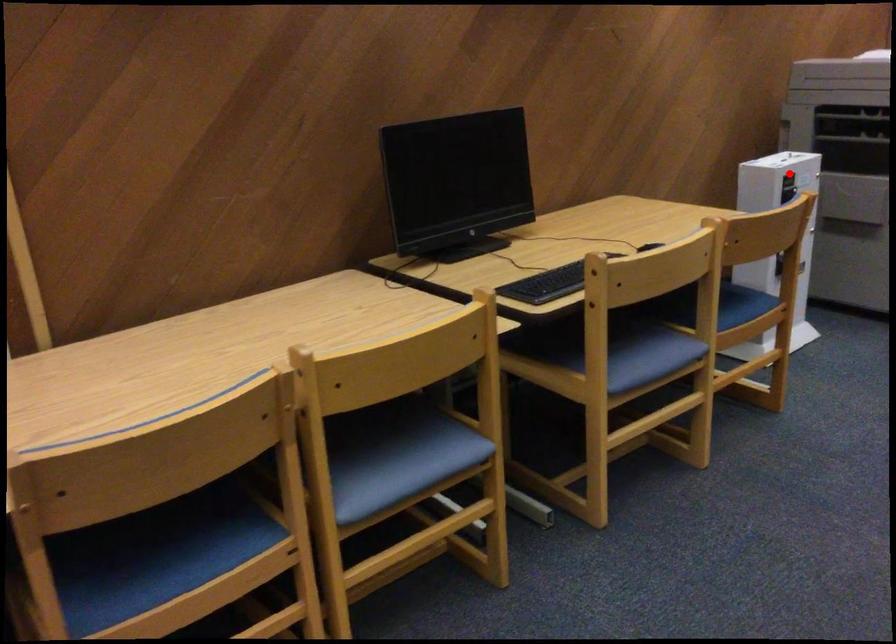
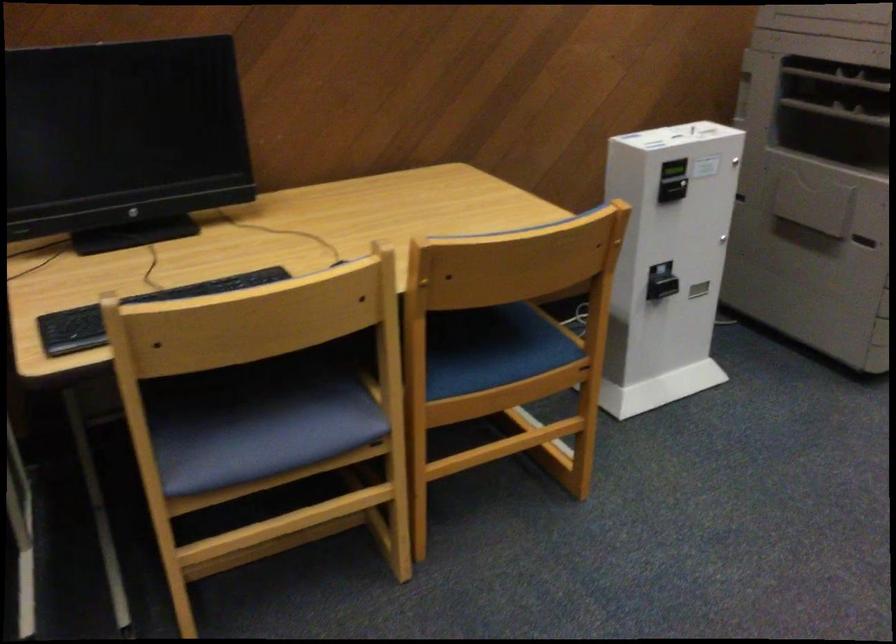
Where in the second image is the point corresponding to the highlighted location from the first image?

(673, 169)